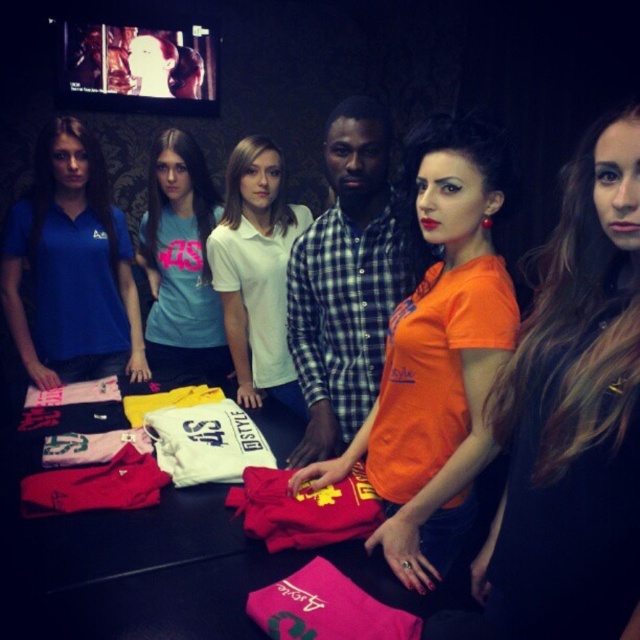
You are organizing a photo shoot and need to arrange the models in order from front to back based on their clothing. The checkered fabric shirt at center and the blue cotton polo shirt at left are two of the models. Which model should be placed first in the front row?

The checkered fabric shirt at center should be placed first in the front row because it is in front of the blue cotton polo shirt at left according to the description.

You are standing in the room and want to move from the point at coordinates point (579, 408) to the point at coordinates point (289, 257). Is the path between them clear?

The point (579, 408) is in front of point (289, 257), so the path between them is clear.